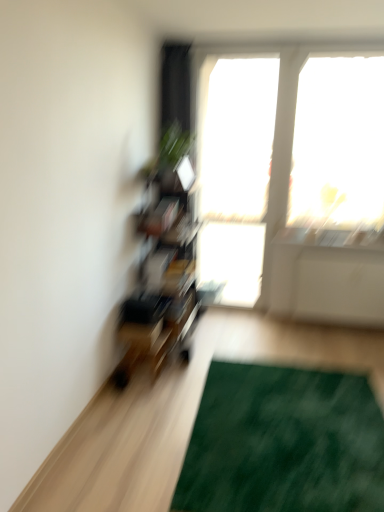
At what (x,y) coordinates should I click in order to perform the action: click on green leafy plant at upper center. Please return your answer as a coordinate pair (x, y). The width and height of the screenshot is (384, 512). Looking at the image, I should click on (169, 151).

In order to face transparent glass window at center, which is counted as the second window screen, starting from the right, should I rotate leftwards or rightwards?

Rotate your view right by about 6.566°.

This screenshot has width=384, height=512. I want to click on transparent glass window at upper right, which appears as the first window screen when viewed from the right, so click(338, 144).

How many degrees apart are the facing directions of green textured mat at lower right and transparent glass window at center, the first window screen from the left?

The angular difference between green textured mat at lower right and transparent glass window at center, the first window screen from the left, is 1.92 degrees.

Is green textured mat at lower right oriented towards transparent glass window at center, which is counted as the second window screen, starting from the right?

No, green textured mat at lower right is not aimed at transparent glass window at center, which is counted as the second window screen, starting from the right.

Measure the distance from green textured mat at lower right to transparent glass window at center, which is counted as the second window screen, starting from the right.

green textured mat at lower right and transparent glass window at center, which is counted as the second window screen, starting from the right, are 2.45 meters apart from each other.

From a real-world perspective, between green textured mat at lower right and transparent glass window at center, which is counted as the second window screen, starting from the right, who is vertically higher?

transparent glass window at center, which is counted as the second window screen, starting from the right.

In terms of width, does transparent glass window at upper right, the 2th window screen in the left-to-right sequence, look wider or thinner when compared to transparent glass window at center, the first window screen from the left?

Considering their sizes, transparent glass window at upper right, the 2th window screen in the left-to-right sequence, looks slimmer than transparent glass window at center, the first window screen from the left.

Considering the relative positions of transparent glass window at upper right, which appears as the first window screen when viewed from the right, and transparent glass window at center, which is counted as the second window screen, starting from the right, in the image provided, is transparent glass window at upper right, which appears as the first window screen when viewed from the right, behind transparent glass window at center, which is counted as the second window screen, starting from the right,?

No, transparent glass window at upper right, which appears as the first window screen when viewed from the right, is in front of transparent glass window at center, which is counted as the second window screen, starting from the right.

From the image's perspective, would you say transparent glass window at upper right, the 2th window screen in the left-to-right sequence, is positioned over green textured mat at lower right?

Yes.

This screenshot has width=384, height=512. I want to click on doormat located underneath the transparent glass window at upper right, which appears as the first window screen when viewed from the right (from a real-world perspective), so click(283, 443).

Is transparent glass window at upper right, the 2th window screen in the left-to-right sequence, far away from green textured mat at lower right?

That's right, there is a large distance between transparent glass window at upper right, the 2th window screen in the left-to-right sequence, and green textured mat at lower right.

From the image's perspective, is green leafy plant at upper center on transparent glass window at center, which is counted as the second window screen, starting from the right?

Yes, from the image's perspective, green leafy plant at upper center is on top of transparent glass window at center, which is counted as the second window screen, starting from the right.

Does green leafy plant at upper center appear on the left side of transparent glass window at center, which is counted as the second window screen, starting from the right?

Indeed, green leafy plant at upper center is positioned on the left side of transparent glass window at center, which is counted as the second window screen, starting from the right.

Which object is thinner, green leafy plant at upper center or transparent glass window at center, which is counted as the second window screen, starting from the right?

transparent glass window at center, which is counted as the second window screen, starting from the right.

Does point (206, 71) come behind point (184, 141)?

Yes, point (206, 71) is behind point (184, 141).

Is transparent glass window at center, which is counted as the second window screen, starting from the right, positioned in front of green leafy plant at upper center?

No, the depth of transparent glass window at center, which is counted as the second window screen, starting from the right, is greater than that of green leafy plant at upper center.

The height and width of the screenshot is (512, 384). I want to click on plant located on the left of transparent glass window at center, which is counted as the second window screen, starting from the right, so click(169, 151).

Is transparent glass window at center, which is counted as the second window screen, starting from the right, far from green leafy plant at upper center?

No, transparent glass window at center, which is counted as the second window screen, starting from the right, is not far from green leafy plant at upper center.

Which of these two, transparent glass window at center, the first window screen from the left, or green textured mat at lower right, stands shorter?

With less height is green textured mat at lower right.

Would you say transparent glass window at center, which is counted as the second window screen, starting from the right, is inside or outside green textured mat at lower right?

transparent glass window at center, which is counted as the second window screen, starting from the right, cannot be found inside green textured mat at lower right.

Is transparent glass window at center, the first window screen from the left, at the right side of green textured mat at lower right?

Result: No, transparent glass window at center, the first window screen from the left, is not to the right of green textured mat at lower right.

Considering the points (283, 447) and (163, 170), which point is behind, point (283, 447) or point (163, 170)?

The point (163, 170) is behind.

From the image's perspective, which one is positioned lower, green textured mat at lower right or green leafy plant at upper center?

From the image's view, green textured mat at lower right is below.

Which object is wider, green textured mat at lower right or green leafy plant at upper center?

Wider between the two is green textured mat at lower right.

Is green leafy plant at upper center surrounded by green textured mat at lower right?

Actually, green leafy plant at upper center is outside green textured mat at lower right.

You are a GUI agent. You are given a task and a screenshot of the screen. Output one action in this format:
    pyautogui.click(x=<x>, y=<y>)
    Task: Click on the doormat in front of the transparent glass window at center, which is counted as the second window screen, starting from the right
    
    Given the screenshot: What is the action you would take?
    pyautogui.click(x=283, y=443)

Locate an element on the screen. The height and width of the screenshot is (512, 384). window screen below the transparent glass window at upper right, which appears as the first window screen when viewed from the right (from the image's perspective) is located at coordinates (236, 137).

Based on their spatial positions, is transparent glass window at center, which is counted as the second window screen, starting from the right, or transparent glass window at upper right, which appears as the first window screen when viewed from the right, further from green textured mat at lower right?

The object further to green textured mat at lower right is transparent glass window at center, which is counted as the second window screen, starting from the right.

From the image, which object appears to be farther from transparent glass window at upper right, the 2th window screen in the left-to-right sequence, green leafy plant at upper center or transparent glass window at center, the first window screen from the left?

green leafy plant at upper center lies further to transparent glass window at upper right, the 2th window screen in the left-to-right sequence, than the other object.

Considering their positions, is green textured mat at lower right positioned closer to transparent glass window at upper right, the 2th window screen in the left-to-right sequence, than transparent glass window at center, the first window screen from the left?

The object closer to transparent glass window at upper right, the 2th window screen in the left-to-right sequence, is transparent glass window at center, the first window screen from the left.

Based on their spatial positions, is green leafy plant at upper center or transparent glass window at center, the first window screen from the left, closer to green textured mat at lower right?

green leafy plant at upper center is closer to green textured mat at lower right.

From the image, which object appears to be farther from green leafy plant at upper center, green textured mat at lower right or transparent glass window at center, the first window screen from the left?

Among the two, green textured mat at lower right is located further to green leafy plant at upper center.

In the scene shown: Looking at the image, which one is located closer to green textured mat at lower right, transparent glass window at upper right, which appears as the first window screen when viewed from the right, or green leafy plant at upper center?

green leafy plant at upper center is closer to green textured mat at lower right.

Considering their positions, is green leafy plant at upper center positioned closer to green textured mat at lower right than transparent glass window at upper right, the 2th window screen in the left-to-right sequence?

Based on the image, green leafy plant at upper center appears to be nearer to green textured mat at lower right.

Looking at the image, which one is located further to transparent glass window at upper right, which appears as the first window screen when viewed from the right, green textured mat at lower right or green leafy plant at upper center?

The object further to transparent glass window at upper right, which appears as the first window screen when viewed from the right, is green textured mat at lower right.

Identify the location of window screen between green leafy plant at upper center and green textured mat at lower right in the vertical direction. (236, 137).

Find the location of a particular element. plant between transparent glass window at upper right, which appears as the first window screen when viewed from the right, and green textured mat at lower right in the up-down direction is located at coordinates (169, 151).

You are a GUI agent. You are given a task and a screenshot of the screen. Output one action in this format:
    pyautogui.click(x=<x>, y=<y>)
    Task: Click on the window screen between transparent glass window at upper right, which appears as the first window screen when viewed from the right, and green textured mat at lower right vertically
    The image size is (384, 512).
    Given the screenshot: What is the action you would take?
    pyautogui.click(x=236, y=137)

Identify the location of window screen situated between green leafy plant at upper center and transparent glass window at upper right, the 2th window screen in the left-to-right sequence, from left to right. (236, 137).